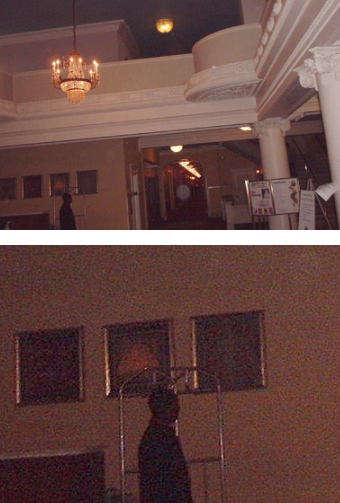
Where is `lobbys`? Image resolution: width=340 pixels, height=503 pixels. lobbys is located at coordinates (115, 151), (76, 284).